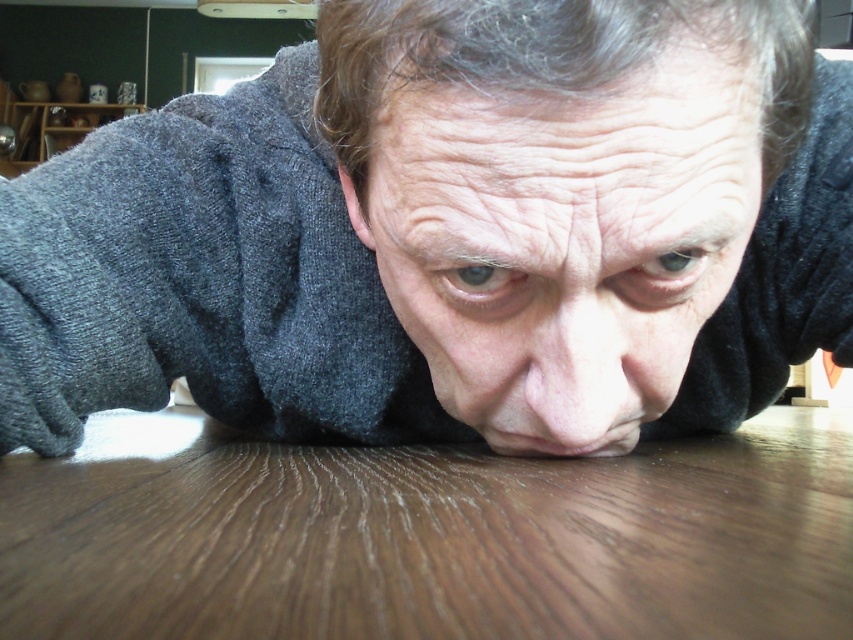
You are a photographer trying to capture the exact location of the point at coordinates (450, 232) in the image. Based on the scene description, where would this point be located?

The point at coordinates (450, 232) is located on the dark gray sweater at center.

What is the exact coordinate of the brown wood table at center?

The brown wood table at center is located at point (427, 536).

You are a photographer trying to capture a close shot of the dark gray sweater at center. You are currently 12 inches away from it. Can you move closer to get a better shot without exceeding the minimum safe distance of 10 inches for sharp focus? Explain your reasoning.

The dark gray sweater at center is 11.14 inches away from the viewer. Since you are currently 12 inches away, moving 0.86 inches closer would bring you to the minimum safe distance of 10.86 inches, which is within the 10 inches limit. Therefore, you can move closer by approximately 0.86 inches to achieve a sharp focus while staying within the safe distance.